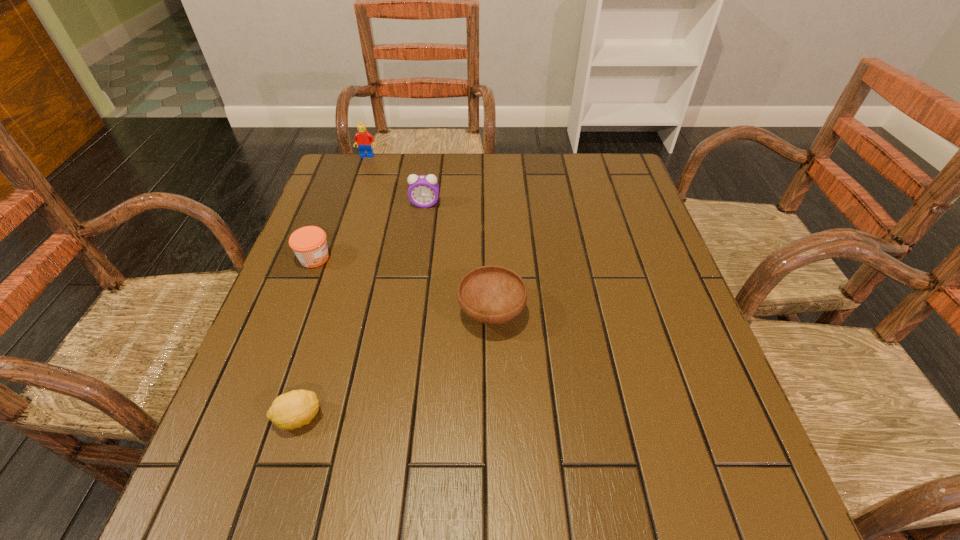
This screenshot has height=540, width=960. I want to click on free space that satisfies the following two spatial constraints: 1. on the front label of the rightmost object; 2. on the right side of the third farthest object, so click(x=294, y=313).

I want to click on free space in the image that satisfies the following two spatial constraints: 1. on the face of the fourth farthest object; 2. on the left side of the fourth shortest object, so click(409, 313).